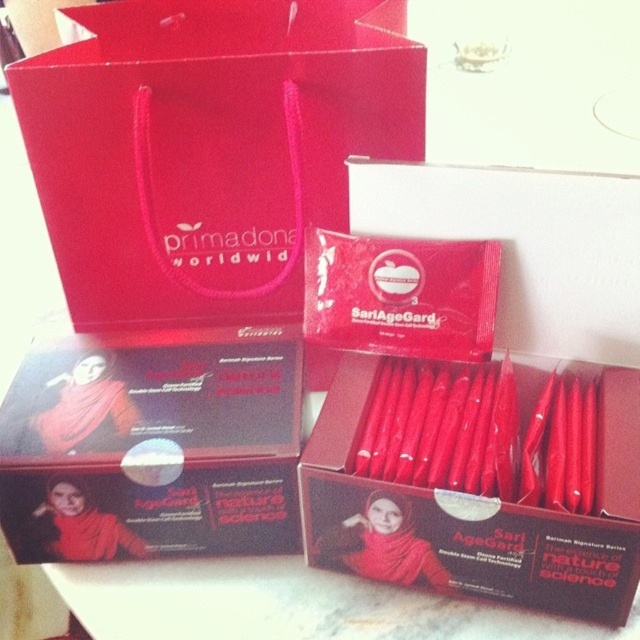
Based on the photo, can you confirm if matte red packet at center is smaller than matte black box at center?

Actually, matte red packet at center might be larger than matte black box at center.

Can you confirm if matte red packet at center is taller than matte black box at center?

Indeed, matte red packet at center has a greater height compared to matte black box at center.

The height and width of the screenshot is (640, 640). What do you see at coordinates (477, 481) in the screenshot?
I see `matte red packet at center` at bounding box center [477, 481].

Locate an element on the screen. matte red packet at center is located at coordinates (477, 481).

Can you confirm if matte paper bag at upper left is positioned below matte red packet at center?

No.

Between point (99, 124) and point (332, 524), which one is positioned in front?

Point (332, 524) is more forward.

The image size is (640, 640). Identify the location of matte paper bag at upper left. (209, 145).

Between matte paper bag at upper left and matte black box at center, which one has less height?

Standing shorter between the two is matte black box at center.

Can you confirm if matte paper bag at upper left is positioned below matte black box at center?

Actually, matte paper bag at upper left is above matte black box at center.

The width and height of the screenshot is (640, 640). What do you see at coordinates (209, 145) in the screenshot? I see `matte paper bag at upper left` at bounding box center [209, 145].

Locate an element on the screen. matte paper bag at upper left is located at coordinates (209, 145).